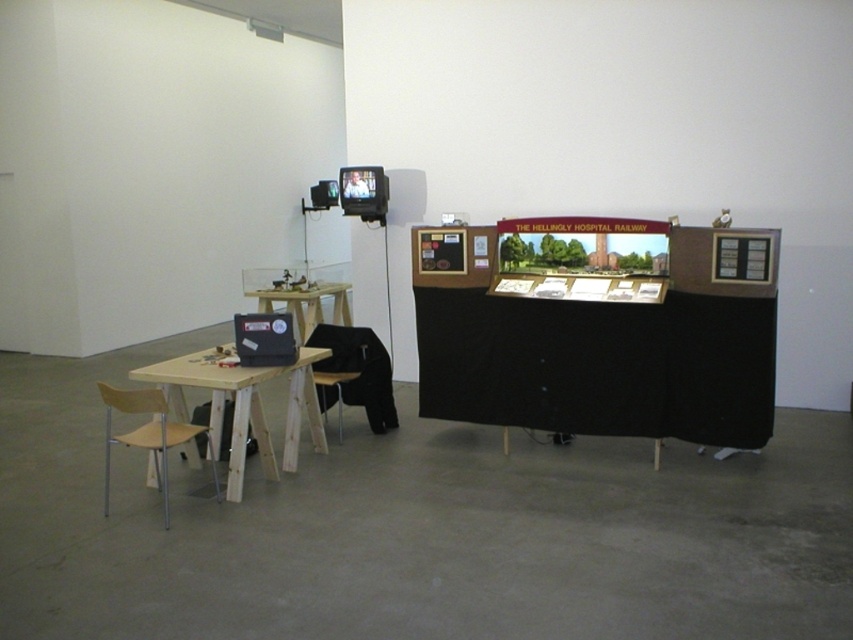
Does wooden table at lower left appear under light brown wooden chair at lower left?

Actually, wooden table at lower left is above light brown wooden chair at lower left.

Does point (289, 433) lie behind point (115, 397)?

Yes, it is behind point (115, 397).

Locate an element on the screen. The width and height of the screenshot is (853, 640). wooden table at lower left is located at coordinates (242, 406).

This screenshot has height=640, width=853. What are the coordinates of `black fabric chair at lower left` in the screenshot? It's located at (357, 371).

Does black fabric chair at lower left come behind light brown wooden chair at lower left?

Yes.

Between point (318, 396) and point (161, 472), which one is positioned behind?

The point (318, 396) is more distant.

At what (x,y) coordinates should I click in order to perform the action: click on black fabric chair at lower left. Please return your answer as a coordinate pair (x, y). This screenshot has width=853, height=640. Looking at the image, I should click on (357, 371).

This screenshot has width=853, height=640. Describe the element at coordinates (143, 433) in the screenshot. I see `light brown wooden chair at lower left` at that location.

Based on the photo, between light brown wooden chair at lower left and wooden table at left, which one is positioned higher?

wooden table at left

Image resolution: width=853 pixels, height=640 pixels. I want to click on light brown wooden chair at lower left, so click(x=143, y=433).